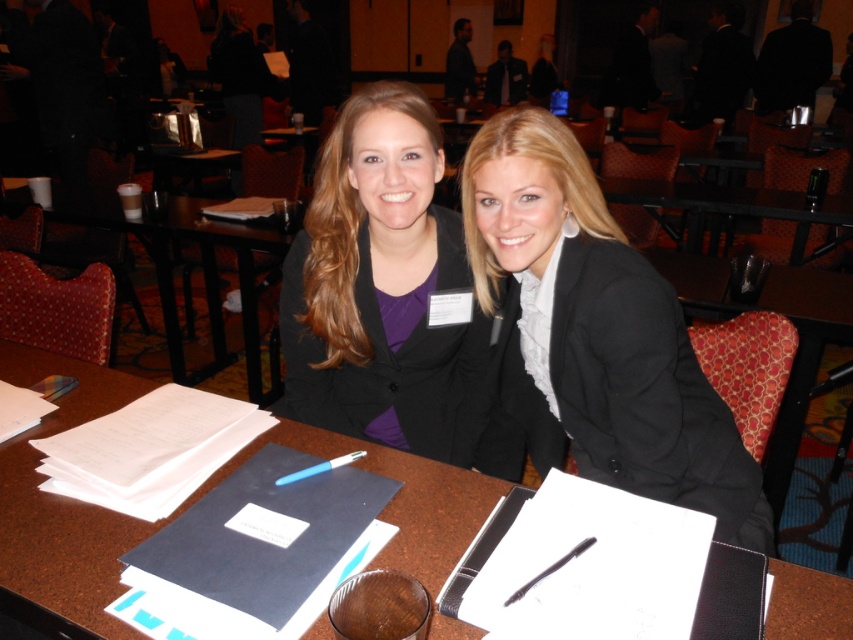
You are organizing a conference and need to place a name tag on the black matte blazer at center so it doesn t fall off. Can you attach it to the blue plastic pen at center instead?

The black matte blazer at center is in front of the blue plastic pen at center, so the pen is behind the blazer. Therefore, attaching the name tag to the blue plastic pen at center would not be visible from the front, so it s better to attach it directly to the blazer.

You are organizing a photoshoot and need to place a 10 cm thick book on the table. Given the space between the matte black blazer at center and the brown wood table at center, will the book fit without overlapping either object?

The matte black blazer at center is thinner than the brown wood table at center, but the description does not provide specific measurements of the space between them. Therefore, it is uncertain whether the 10 cm thick book will fit without overlapping either object.

From the picture: You are at a conference and need to place a small notebook on the table. The table is represented by the point at coordinates point (201, 266). If the notebook is placed exactly at this point, will it be centered on the brown wooden table at center?

The point (201, 266) corresponds to the brown wooden table at center, so placing the notebook at this point would center it on the table.